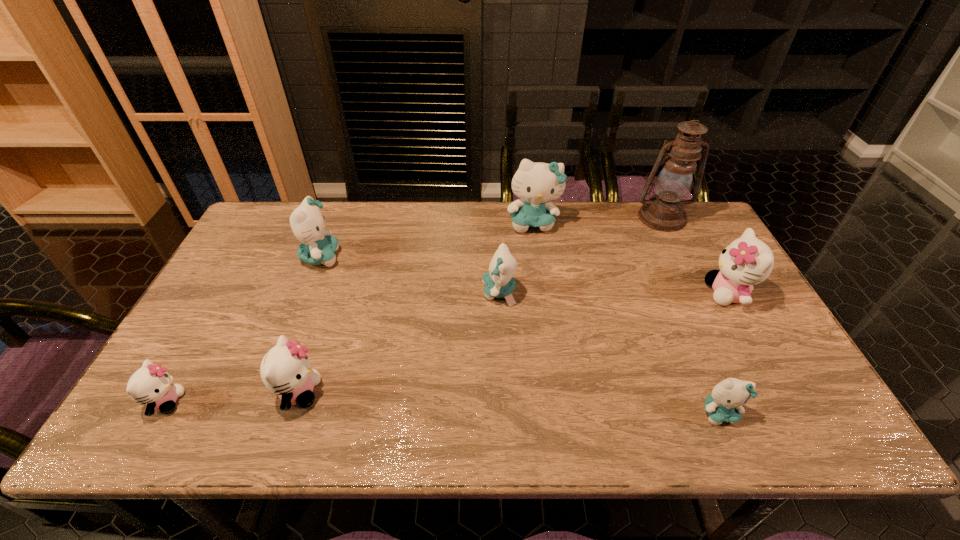
This screenshot has height=540, width=960. In order to click on the leftmost white kitten in this screenshot , I will do `click(151, 384)`.

The image size is (960, 540). Identify the location of the nearest blue kitten. pos(726,402).

This screenshot has width=960, height=540. What are the coordinates of `the smallest blue kitten` in the screenshot? It's located at (726, 402).

Where is `vacant point located on the left of the tallest object`? The height and width of the screenshot is (540, 960). vacant point located on the left of the tallest object is located at coordinates (523, 218).

I want to click on blank space located 0.370m on the face of the farthest kitten, so click(547, 324).

I want to click on vacant space located 0.260m on the face of the leftmost blue kitten, so click(424, 257).

This screenshot has height=540, width=960. Find the location of `blank space located 0.090m on the front-facing side of the rightmost white kitten`. blank space located 0.090m on the front-facing side of the rightmost white kitten is located at coordinates (674, 293).

Locate an element on the screen. free space located on the front-facing side of the rightmost white kitten is located at coordinates (617, 293).

You are a GUI agent. You are given a task and a screenshot of the screen. Output one action in this format:
    pyautogui.click(x=<x>, y=<y>)
    Task: Click on the free location located 0.330m on the front-facing side of the rightmost white kitten
    
    Given the screenshot: What is the action you would take?
    pyautogui.click(x=589, y=293)

Find the location of a particular element. This screenshot has height=540, width=960. vacant region located on the face of the second smallest blue kitten is located at coordinates (454, 292).